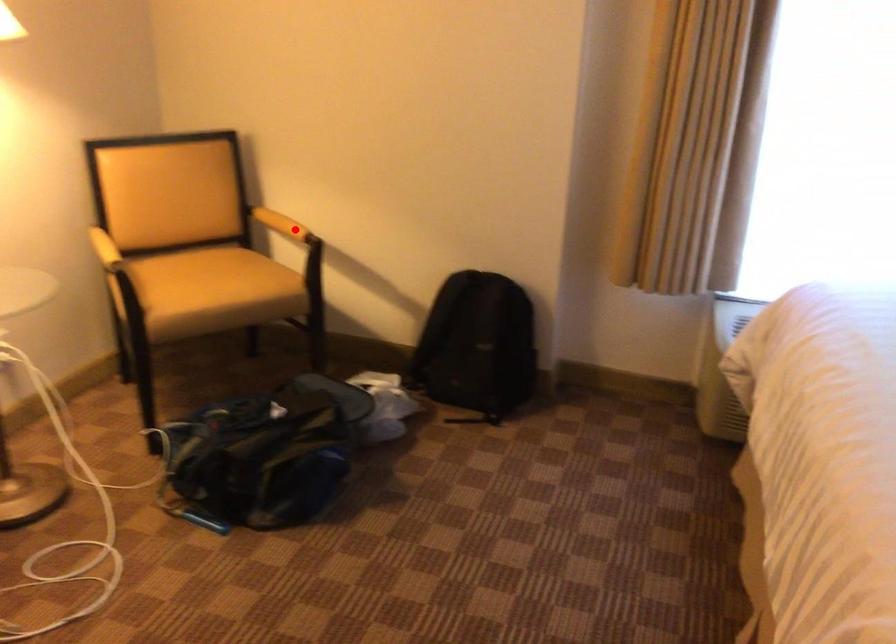
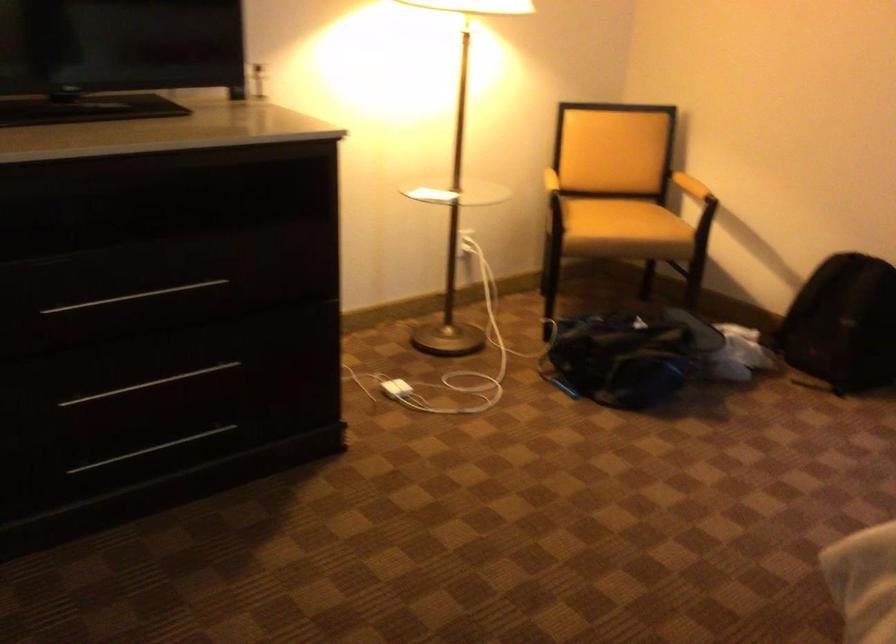
Question: I am providing you with two images of the same scene from different viewpoints. In image1, a red point is highlighted. Considering the same 3D point in image2, which of the following is correct?

Choices:
 (A) It is closer
 (B) It is farther

Answer: (B)